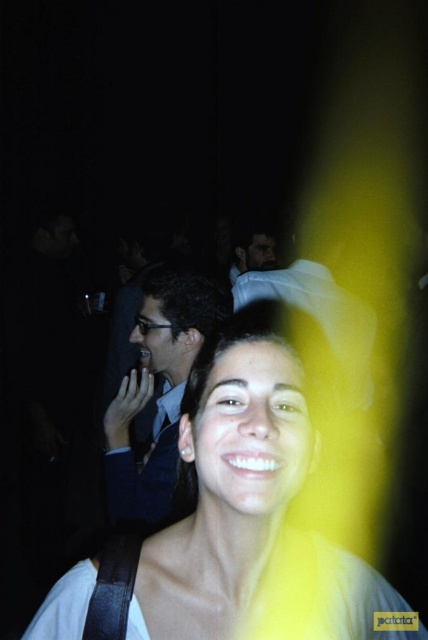
Question: Does white matte face at center have a smaller size compared to matte black suit at center?

Choices:
 (A) yes
 (B) no

Answer: (B)

Question: Considering the real-world distances, which object is farthest from the matte black suit at center?

Choices:
 (A) matte white shirt at center
 (B) white matte face at center

Answer: (B)

Question: Among these points, which one is nearest to the camera?

Choices:
 (A) (409, 636)
 (B) (192, 323)

Answer: (A)

Question: Which point is closer to the camera taking this photo?

Choices:
 (A) pos(109,419)
 (B) pos(178,388)

Answer: (B)

Question: Can you confirm if white matte face at center is positioned below matte black suit at center?

Choices:
 (A) no
 (B) yes

Answer: (B)

Question: Does white matte face at center come behind matte black suit at center?

Choices:
 (A) yes
 (B) no

Answer: (B)